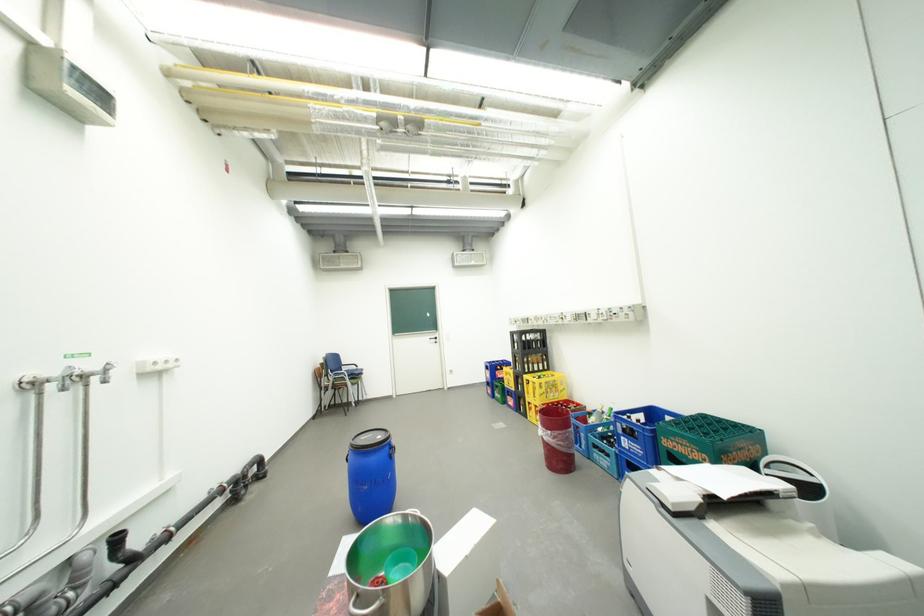
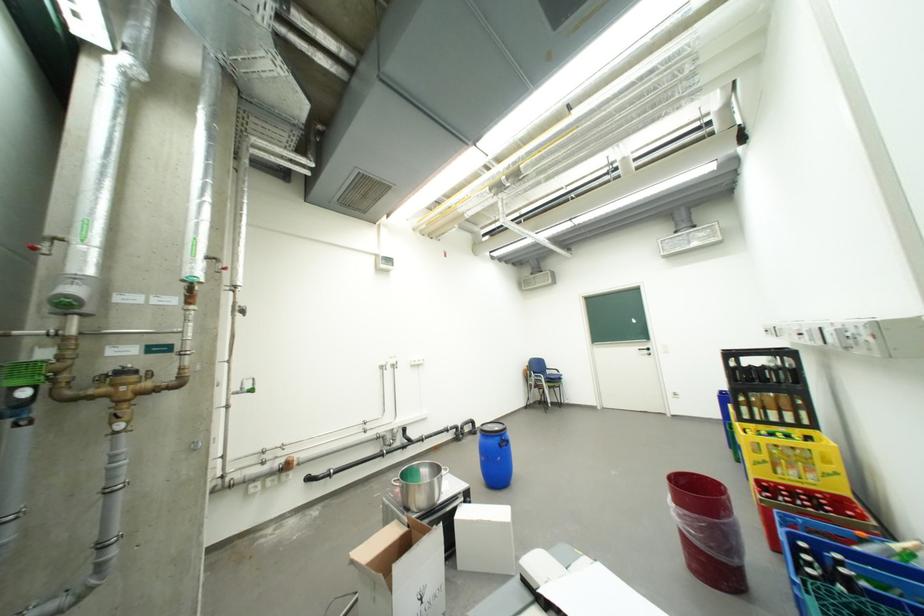
Find the pixel in the second image that matches point (560, 434) in the first image.

(685, 507)